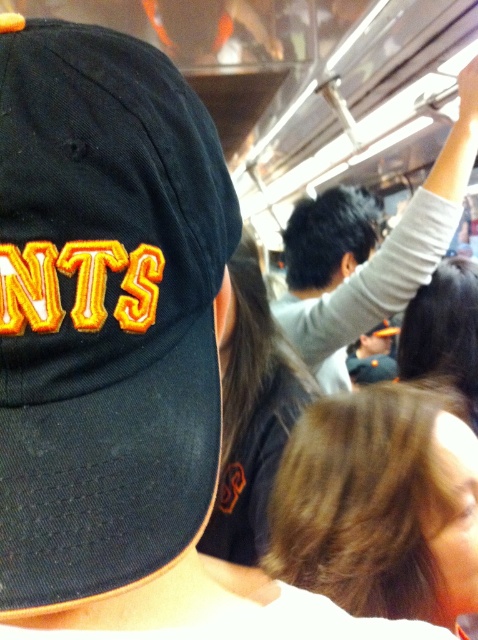
Question: Among these objects, which one is farthest from the camera?

Choices:
 (A) gray fabric shirt at upper right
 (B) navy blue fabric baseball cap at left
 (C) brown hair at center

Answer: (A)

Question: Where is navy blue fabric baseball cap at left located in relation to gray fabric shirt at upper right in the image?

Choices:
 (A) below
 (B) above

Answer: (A)

Question: From the image, what is the correct spatial relationship of navy blue fabric baseball cap at left in relation to gray fabric shirt at upper right?

Choices:
 (A) left
 (B) right

Answer: (A)

Question: Estimate the real-world distances between objects in this image. Which object is closer to the navy blue fabric baseball cap at left?

Choices:
 (A) brown hair at center
 (B) gray fabric shirt at upper right

Answer: (A)

Question: Is navy blue fabric baseball cap at left above brown hair at center?

Choices:
 (A) yes
 (B) no

Answer: (A)

Question: Among these objects, which one is farthest from the camera?

Choices:
 (A) navy blue fabric baseball cap at left
 (B) brown hair at center
 (C) gray fabric shirt at upper right

Answer: (C)